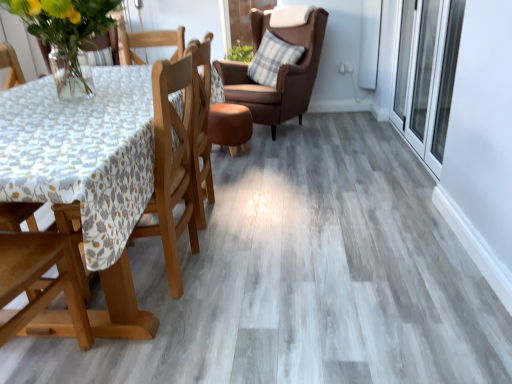
Question: In terms of width, does wooden chair at left, positioned as the first chair in bottom-to-top order, look wider or thinner when compared to translucent glass vase at upper left?

Choices:
 (A) wide
 (B) thin

Answer: (A)

Question: From a real-world perspective, is wooden chair at left, which is the 2th chair from top to bottom, positioned above or below translucent glass vase at upper left?

Choices:
 (A) below
 (B) above

Answer: (A)

Question: Estimate the real-world distances between objects in this image. Which object is farther from the wooden chair at left, acting as the first chair starting from the front?

Choices:
 (A) translucent glass vase at upper left
 (B) plaid fabric pillow at upper right
 (C) transparent glass screen door at right
 (D) brown leather chair at upper center, arranged as the second chair when ordered from the bottom

Answer: (B)

Question: Estimate the real-world distances between objects in this image. Which object is closer to the plaid fabric pillow at upper right?

Choices:
 (A) translucent glass vase at upper left
 (B) transparent glass screen door at right
 (C) wooden chair at left, which is the 2th chair from top to bottom
 (D) brown leather chair at upper center, the 1th chair when ordered from top to bottom

Answer: (D)